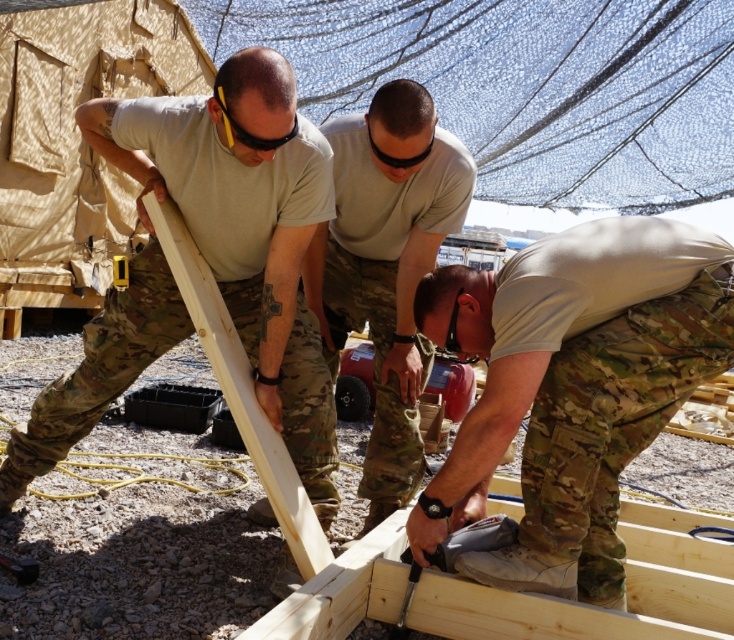
You are a construction supervisor observing the scene. You need to ensure that the matte khaki shirt at center and the metallic silver screwdriver at lower center are visible to your team. Which object should you point out first to ensure your team can see it easily?

The matte khaki shirt at center is larger in size than the metallic silver screwdriver at lower center, so it will be easier for the team to see the matte khaki shirt at center first.

You are a construction worker observing the scene. You need to access the metallic silver screwdriver at lower center. Is the camouflage fabric pants at lower center blocking your direct access to it?

The camouflage fabric pants at lower center is positioned over the metallic silver screwdriver at lower center, so yes, the pants are blocking direct access to the screwdriver.

You are observing a construction site and need to identify the taller object between the camouflage fabric pants at lower center and the metallic silver screwdriver at lower center. Which one is taller?

The camouflage fabric pants at lower center is taller than the metallic silver screwdriver at lower center according to the description.